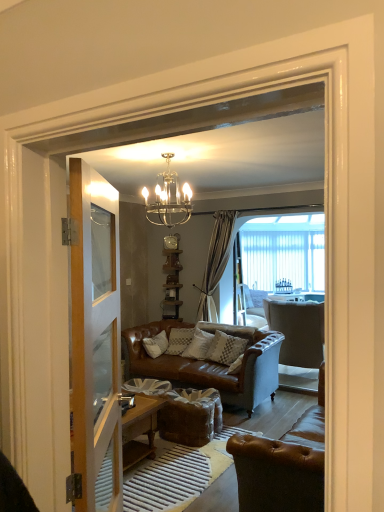
Image resolution: width=384 pixels, height=512 pixels. I want to click on free region under clear glass chandelier at upper center (from a real-world perspective), so click(166, 473).